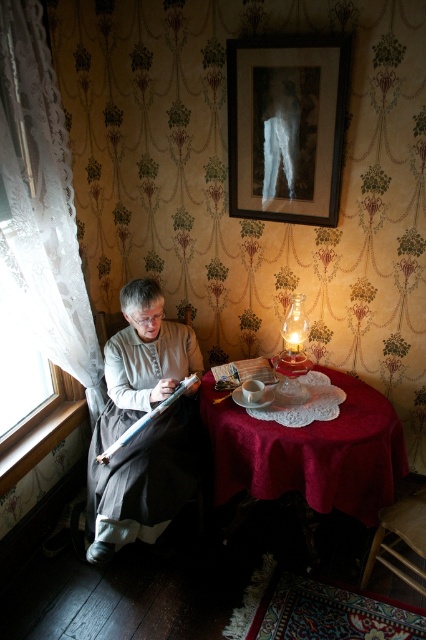
Between white lace curtain at left and wooden framed print at upper center, which one appears on the left side from the viewer's perspective?

white lace curtain at left is more to the left.

Can you confirm if white lace curtain at left is shorter than wooden framed print at upper center?

No.

This screenshot has width=426, height=640. I want to click on white lace curtain at left, so click(42, 204).

Identify the location of white lace curtain at left. (42, 204).

Does wooden framed print at upper center lie in front of velvet red tablecloth at center?

That is False.

Is point (313, 113) positioned behind point (319, 508)?

Yes.

Is point (290, 163) in front of point (376, 438)?

That is False.

Where is `wooden framed print at upper center`? wooden framed print at upper center is located at coordinates (287, 125).

Can you confirm if white lace curtain at left is thinner than gray woolen robe at left?

Yes.

Does point (6, 262) lie behind point (126, 397)?

No, (6, 262) is closer to viewer.

You are a GUI agent. You are given a task and a screenshot of the screen. Output one action in this format:
    pyautogui.click(x=<x>, y=<y>)
    Task: Click on the white lace curtain at left
    The height and width of the screenshot is (640, 426).
    Given the screenshot: What is the action you would take?
    pyautogui.click(x=42, y=204)